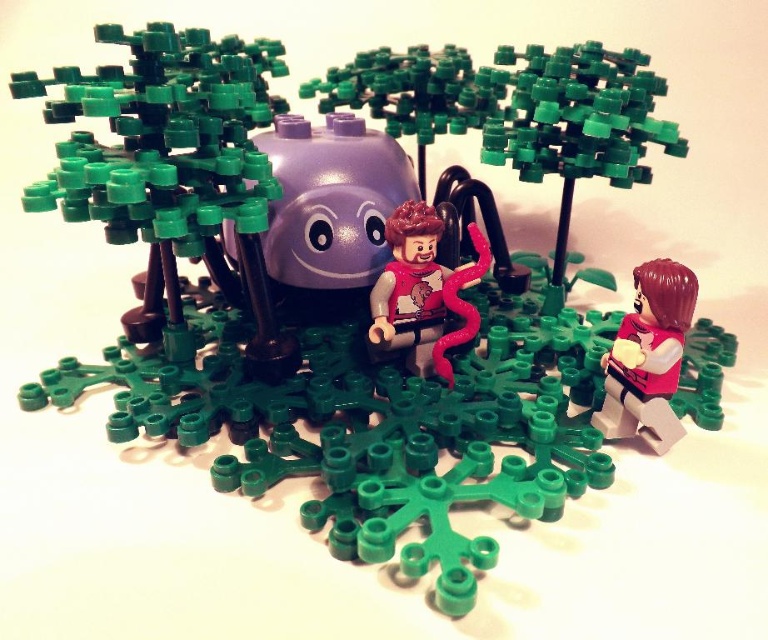
Does smooth red vest at lower right appear on the left side of smooth red vest at center?

No, smooth red vest at lower right is not to the left of smooth red vest at center.

Does smooth red vest at lower right appear on the right side of smooth red vest at center?

Correct, you'll find smooth red vest at lower right to the right of smooth red vest at center.

Image resolution: width=768 pixels, height=640 pixels. What do you see at coordinates (649, 356) in the screenshot?
I see `smooth red vest at lower right` at bounding box center [649, 356].

You are a GUI agent. You are given a task and a screenshot of the screen. Output one action in this format:
    pyautogui.click(x=<x>, y=<y>)
    Task: Click on the smooth red vest at lower right
    Image resolution: width=768 pixels, height=640 pixels.
    Given the screenshot: What is the action you would take?
    pyautogui.click(x=649, y=356)